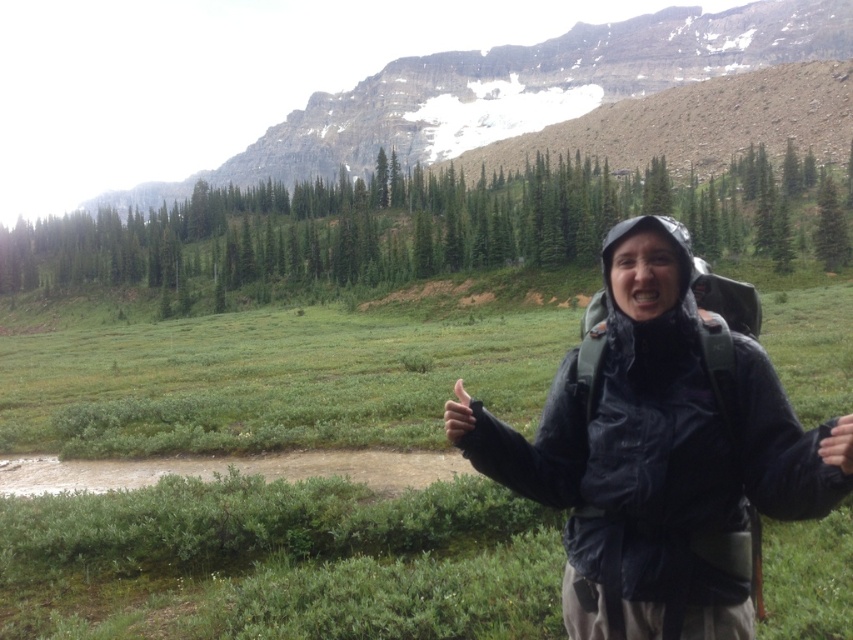
Consider the image. You are a hiker standing at the point closer to the mountain peaks. You see two points marked in the image, point 1 at coordinates [665,333] and point 2 at [699,56]. Which point is closer to you?

Point 1 at coordinates [665,333] is closer to you because it is closer to the viewer than point 2 at [699,56] according to the description.

You are a photographer trying to capture the matte black jacket at center in your shot. The camera you are using has a focal point at coordinates 0.713, 0.774. Will the jacket be in focus?

The matte black jacket at center is located at point (659, 456), so yes, the jacket will be in focus because the camera focal point matches its location.

You are a photographer trying to capture a hiker in a matte black jacket at center against the backdrop of a green grassy mountain at upper center. Based on their relative sizes in the image, which subject would appear larger in your photo?

The matte black jacket at center appears larger in the photo because it is shorter than the green grassy mountain at upper center, meaning it is closer to the camera.